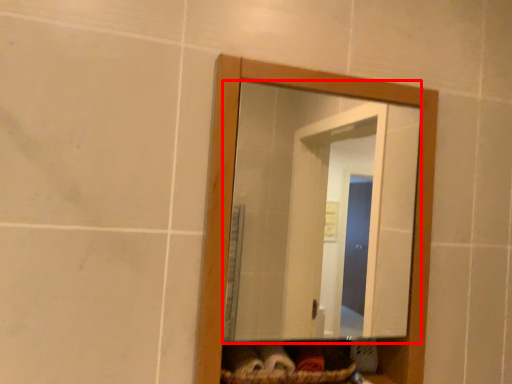
Question: Considering the relative positions of mirror (annotated by the red box) and basket in the image provided, where is mirror (annotated by the red box) located with respect to the staircase?

Choices:
 (A) left
 (B) right

Answer: (B)